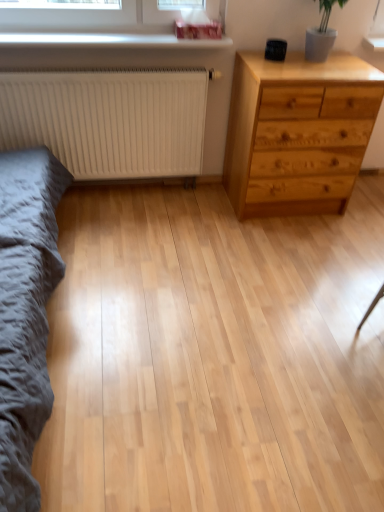
In order to click on free spot in front of natural wood chest of drawers at right in this screenshot , I will do `click(294, 249)`.